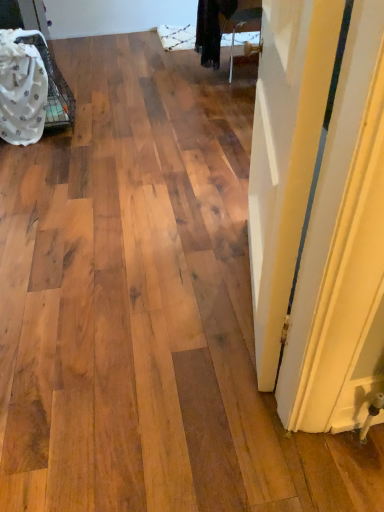
Locate an element on the screen. free location in front of white fabric at left is located at coordinates (40, 158).